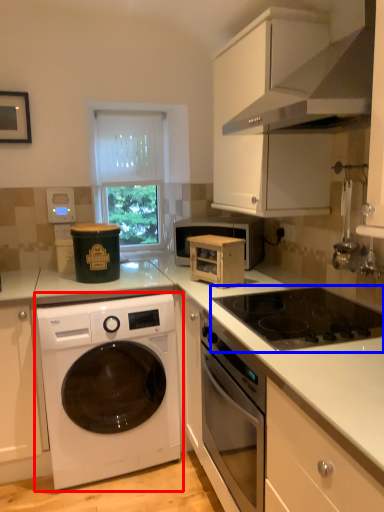
Question: Which object appears closest to the camera in this image, washing machine (highlighted by a red box) or gas stove (highlighted by a blue box)?

Choices:
 (A) washing machine
 (B) gas stove

Answer: (B)